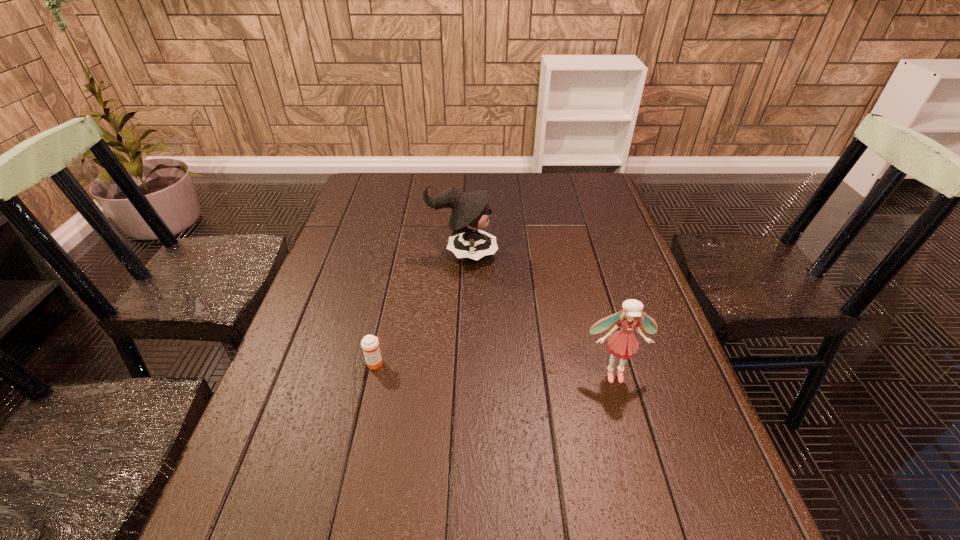
This screenshot has width=960, height=540. What are the coordinates of `free spot between the farthest object and the rightmost object` in the screenshot? It's located at (539, 314).

The width and height of the screenshot is (960, 540). I want to click on free space that is in between the second object from right to left and the leftmost object, so click(419, 308).

This screenshot has width=960, height=540. Identify the location of vacant area that lies between the medicine and the right doll. (494, 368).

At what (x,y) coordinates should I click in order to perform the action: click on unoccupied area between the rightmost object and the medicine. Please return your answer as a coordinate pair (x, y). The image size is (960, 540). Looking at the image, I should click on (494, 368).

Locate an element on the screen. This screenshot has width=960, height=540. object that stands as the second closest to the farther doll is located at coordinates (623, 344).

Point out which object is positioned as the second nearest to the nearer doll. Please provide its 2D coordinates. Your answer should be formatted as a tuple, i.e. [(x, y)], where the tuple contains the x and y coordinates of a point satisfying the conditions above.

[(370, 344)]